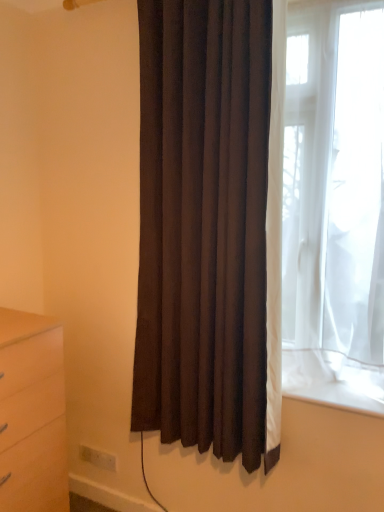
Describe the element at coordinates (98, 457) in the screenshot. The width and height of the screenshot is (384, 512). I see `white plastic electric outlet at lower left` at that location.

This screenshot has height=512, width=384. In order to click on dark brown fabric curtain at center in this screenshot , I will do `click(204, 226)`.

Describe the element at coordinates (32, 414) in the screenshot. Image resolution: width=384 pixels, height=512 pixels. I see `matte wood chest of drawers at lower left` at that location.

At what (x,y) coordinates should I click in order to perform the action: click on white plastic electric outlet at lower left. Please return your answer as a coordinate pair (x, y). Looking at the image, I should click on (98, 457).

Does white plastic electric outlet at lower left touch dark brown fabric curtain at center?

white plastic electric outlet at lower left and dark brown fabric curtain at center are clearly separated.

Which point is more distant from viewer, (96,452) or (150,261)?

Point (96,452)

From the image's perspective, who appears lower, white plastic electric outlet at lower left or dark brown fabric curtain at center?

white plastic electric outlet at lower left, from the image's perspective.

Image resolution: width=384 pixels, height=512 pixels. I want to click on curtain above the white plastic electric outlet at lower left (from a real-world perspective), so click(204, 226).

From the picture: Considering the positions of objects dark brown fabric curtain at center and matte wood chest of drawers at lower left in the image provided, who is behind, dark brown fabric curtain at center or matte wood chest of drawers at lower left?

matte wood chest of drawers at lower left is behind.

How far apart are dark brown fabric curtain at center and matte wood chest of drawers at lower left?

A distance of 58.20 centimeters exists between dark brown fabric curtain at center and matte wood chest of drawers at lower left.

Is dark brown fabric curtain at center at the right side of matte wood chest of drawers at lower left?

Yes, dark brown fabric curtain at center is to the right of matte wood chest of drawers at lower left.

Is dark brown fabric curtain at center beside white plastic electric outlet at lower left?

No.

Who is shorter, dark brown fabric curtain at center or white plastic electric outlet at lower left?

white plastic electric outlet at lower left is shorter.

Considering the sizes of objects dark brown fabric curtain at center and white plastic electric outlet at lower left in the image provided, who is wider, dark brown fabric curtain at center or white plastic electric outlet at lower left?

With larger width is dark brown fabric curtain at center.

From a real-world perspective, between dark brown fabric curtain at center and white plastic electric outlet at lower left, who is vertically higher?

dark brown fabric curtain at center, from a real-world perspective.

Find the location of a particular element. chest of drawers below the dark brown fabric curtain at center (from a real-world perspective) is located at coordinates [32, 414].

Looking at this image, is matte wood chest of drawers at lower left to the right of dark brown fabric curtain at center from the viewer's perspective?

No.

Who is bigger, matte wood chest of drawers at lower left or dark brown fabric curtain at center?

dark brown fabric curtain at center is bigger.

Are matte wood chest of drawers at lower left and white plastic electric outlet at lower left located far from each other?

That's not correct — matte wood chest of drawers at lower left is a little close to white plastic electric outlet at lower left.

Does matte wood chest of drawers at lower left turn towards white plastic electric outlet at lower left?

No, matte wood chest of drawers at lower left is not aimed at white plastic electric outlet at lower left.

In order to click on chest of drawers located on the left of white plastic electric outlet at lower left in this screenshot , I will do (32, 414).

From a real-world perspective, relative to white plastic electric outlet at lower left, is matte wood chest of drawers at lower left vertically above or below?

matte wood chest of drawers at lower left is above white plastic electric outlet at lower left.

Is the depth of white plastic electric outlet at lower left greater than that of matte wood chest of drawers at lower left?

Yes, it is behind matte wood chest of drawers at lower left.

Considering the relative sizes of white plastic electric outlet at lower left and matte wood chest of drawers at lower left in the image provided, is white plastic electric outlet at lower left taller than matte wood chest of drawers at lower left?

Incorrect, the height of white plastic electric outlet at lower left is not larger of that of matte wood chest of drawers at lower left.

From the image's perspective, which one is positioned higher, white plastic electric outlet at lower left or matte wood chest of drawers at lower left?

From the image's view, matte wood chest of drawers at lower left is above.

From a real-world perspective, between white plastic electric outlet at lower left and matte wood chest of drawers at lower left, who is vertically lower?

white plastic electric outlet at lower left.

Find the location of a particular element. curtain positioned vertically above the white plastic electric outlet at lower left (from a real-world perspective) is located at coordinates [x=204, y=226].

The width and height of the screenshot is (384, 512). I want to click on curtain that is above the matte wood chest of drawers at lower left (from the image's perspective), so [x=204, y=226].

When comparing their distances from dark brown fabric curtain at center, does white plastic electric outlet at lower left or matte wood chest of drawers at lower left seem closer?

Based on the image, matte wood chest of drawers at lower left appears to be nearer to dark brown fabric curtain at center.

Estimate the real-world distances between objects in this image. Which object is closer to white plastic electric outlet at lower left, matte wood chest of drawers at lower left or dark brown fabric curtain at center?

The object closer to white plastic electric outlet at lower left is matte wood chest of drawers at lower left.

From the image, which object appears to be nearer to white plastic electric outlet at lower left, dark brown fabric curtain at center or matte wood chest of drawers at lower left?

The object closer to white plastic electric outlet at lower left is matte wood chest of drawers at lower left.

When comparing their distances from matte wood chest of drawers at lower left, does dark brown fabric curtain at center or white plastic electric outlet at lower left seem further?

Among the two, white plastic electric outlet at lower left is located further to matte wood chest of drawers at lower left.

Estimate the real-world distances between objects in this image. Which object is further from matte wood chest of drawers at lower left, white plastic electric outlet at lower left or dark brown fabric curtain at center?

Based on the image, white plastic electric outlet at lower left appears to be further to matte wood chest of drawers at lower left.

Considering their positions, is matte wood chest of drawers at lower left positioned closer to dark brown fabric curtain at center than white plastic electric outlet at lower left?

Among the two, matte wood chest of drawers at lower left is located nearer to dark brown fabric curtain at center.

At what (x,y) coordinates should I click in order to perform the action: click on the chest of drawers between dark brown fabric curtain at center and white plastic electric outlet at lower left vertically. Please return your answer as a coordinate pair (x, y). The width and height of the screenshot is (384, 512). Looking at the image, I should click on (32, 414).